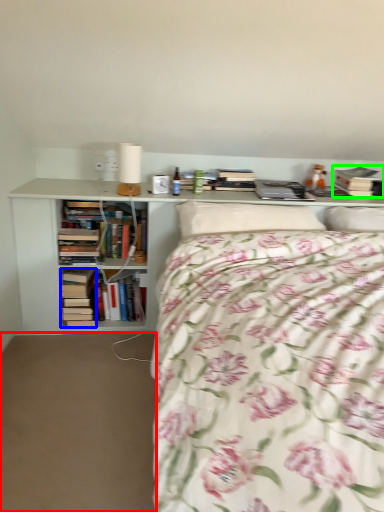
Question: Which object is positioned farthest from plain (highlighted by a red box)? Select from book (highlighted by a blue box) and book (highlighted by a green box).

Choices:
 (A) book
 (B) book

Answer: (B)